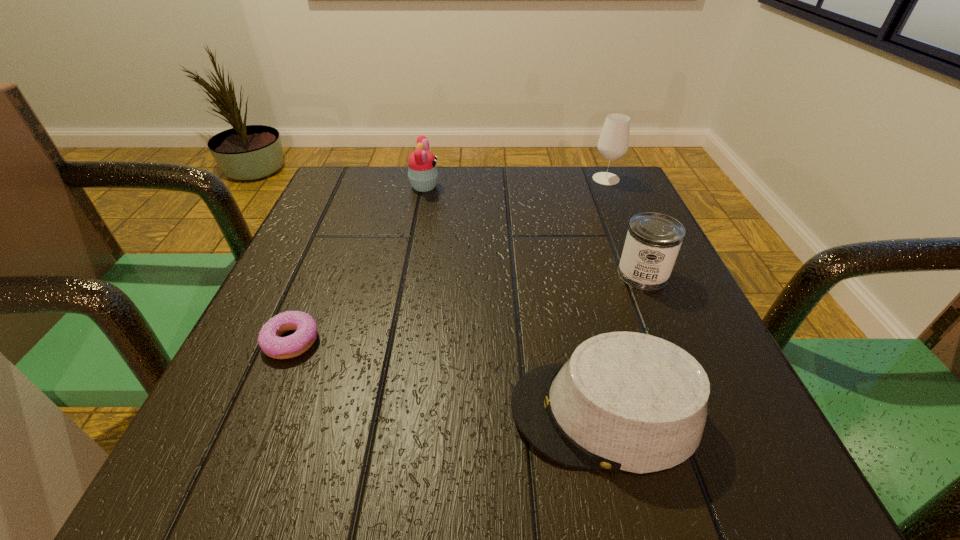
Identify the location of vacant space situated on the front-facing side of the hat. (324, 413).

This screenshot has width=960, height=540. I want to click on vacant space located on the front-facing side of the hat, so click(324, 413).

I want to click on vacant space located on the front of the doughnut, so click(x=251, y=438).

Identify the location of glass at the far edge. This screenshot has height=540, width=960. (613, 142).

Locate an element on the screen. Image resolution: width=960 pixels, height=540 pixels. cupcake that is at the far edge is located at coordinates (422, 169).

Where is `object located in the near edge section of the desktop`? object located in the near edge section of the desktop is located at coordinates [x=625, y=401].

You are a GUI agent. You are given a task and a screenshot of the screen. Output one action in this format:
    pyautogui.click(x=<x>, y=<y>)
    Task: Click on the object situated at the left edge
    The image size is (960, 540).
    Given the screenshot: What is the action you would take?
    pyautogui.click(x=270, y=341)

The height and width of the screenshot is (540, 960). In order to click on glass present at the right edge in this screenshot , I will do `click(613, 142)`.

Locate an element on the screen. This screenshot has height=540, width=960. can that is at the right edge is located at coordinates (653, 240).

Where is `hat that is at the right edge`? The height and width of the screenshot is (540, 960). hat that is at the right edge is located at coordinates (625, 401).